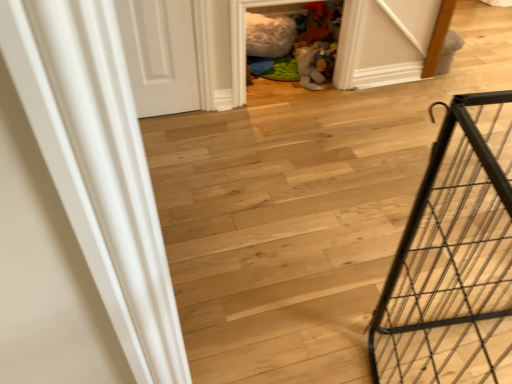
In order to click on free space in front of white matte door at upper left in this screenshot , I will do `click(169, 135)`.